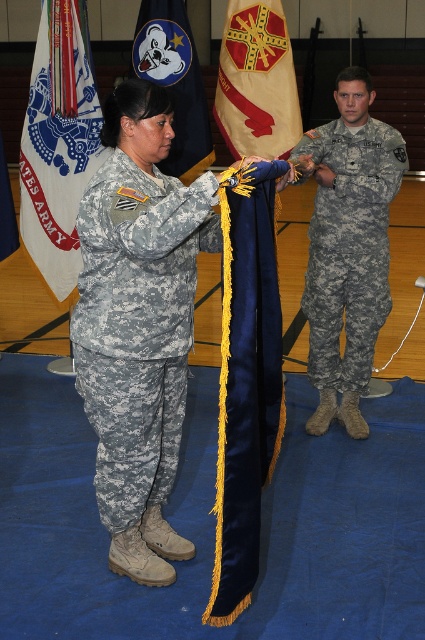
You are an observer at the ceremony. You notice the camouflage fabric uniform at center and the beige fabric flag at center. Which object is positioned lower in the scene?

The camouflage fabric uniform at center is positioned below the beige fabric flag at center, so it is lower in the scene.